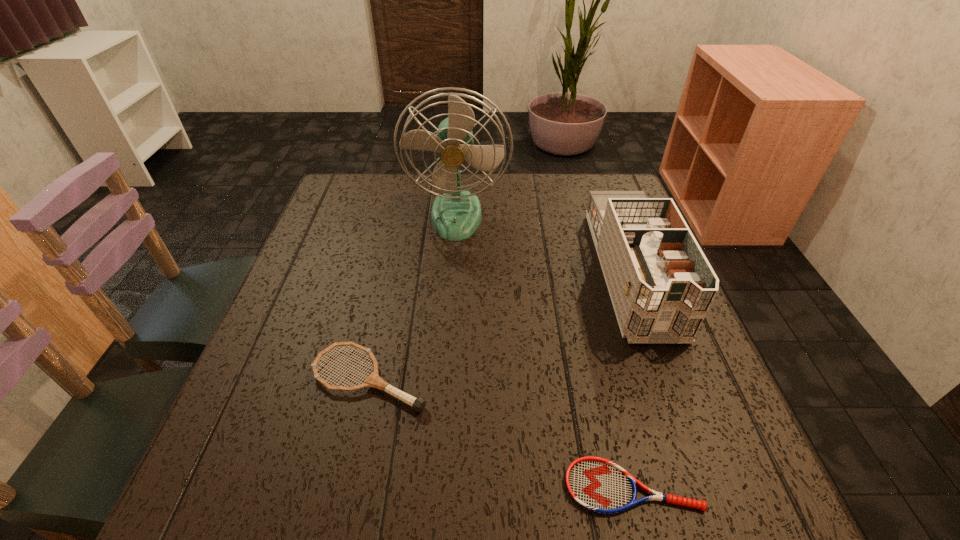
Identify the location of fan. (455, 215).

Locate an element on the screen. The image size is (960, 540). dollhouse is located at coordinates (661, 285).

Where is `the second shortest object`? Image resolution: width=960 pixels, height=540 pixels. the second shortest object is located at coordinates (373, 380).

Locate an element on the screen. The width and height of the screenshot is (960, 540). the farther tennis racket is located at coordinates (373, 380).

Locate an element on the screen. This screenshot has width=960, height=540. the right tennis racket is located at coordinates (596, 484).

Where is `the shortest object`? the shortest object is located at coordinates (596, 484).

You are a GUI agent. You are given a task and a screenshot of the screen. Output one action in this format:
    pyautogui.click(x=<x>, y=<y>)
    Task: Click on the free spot located in front of the tallest object, directing airflow
    
    Given the screenshot: What is the action you would take?
    pyautogui.click(x=454, y=253)

This screenshot has height=540, width=960. In order to click on free space located at the entrance of the dollhouse in this screenshot , I will do `click(720, 511)`.

Where is `vacant space located 0.320m on the right of the left tennis racket`? This screenshot has width=960, height=540. vacant space located 0.320m on the right of the left tennis racket is located at coordinates (598, 379).

Locate an element on the screen. free location located on the left of the shorter tennis racket is located at coordinates (483, 486).